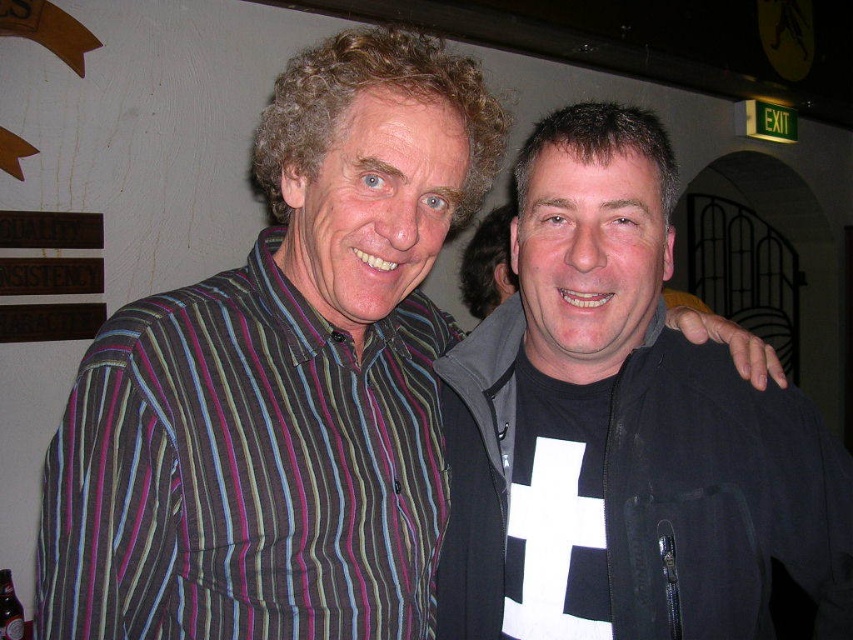
Does black matte jacket at right have a greater height compared to striped cotton shirt at left?

Yes.

Can you confirm if black matte jacket at right is shorter than striped cotton shirt at left?

No.

At what (x,y) coordinates should I click in order to perform the action: click on black matte jacket at right. Please return your answer as a coordinate pair (x, y). This screenshot has width=853, height=640. Looking at the image, I should click on (628, 417).

Find the location of `black matte jacket at right`. black matte jacket at right is located at coordinates (628, 417).

Which of these two, black matte jacket at right or brown glass bottle at lower left, stands shorter?

brown glass bottle at lower left

Can you confirm if black matte jacket at right is shorter than brown glass bottle at lower left?

No, black matte jacket at right is not shorter than brown glass bottle at lower left.

Locate an element on the screen. The image size is (853, 640). black matte jacket at right is located at coordinates (628, 417).

Can you confirm if striped cotton shirt at left is thinner than brown glass bottle at lower left?

→ In fact, striped cotton shirt at left might be wider than brown glass bottle at lower left.

Is point (90, 365) less distant than point (10, 621)?

Yes, point (90, 365) is in front of point (10, 621).

Where is `striped cotton shirt at left`? The image size is (853, 640). striped cotton shirt at left is located at coordinates (245, 470).

Locate an element on the screen. The height and width of the screenshot is (640, 853). striped cotton shirt at left is located at coordinates (245, 470).